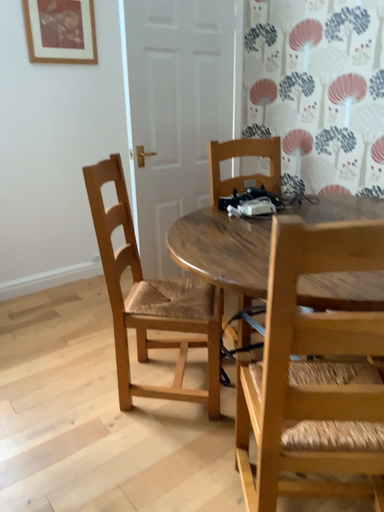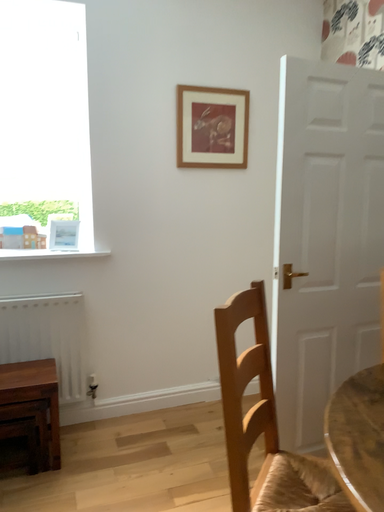
Question: How did the camera likely rotate when shooting the video?

Choices:
 (A) rotated left
 (B) rotated right

Answer: (A)